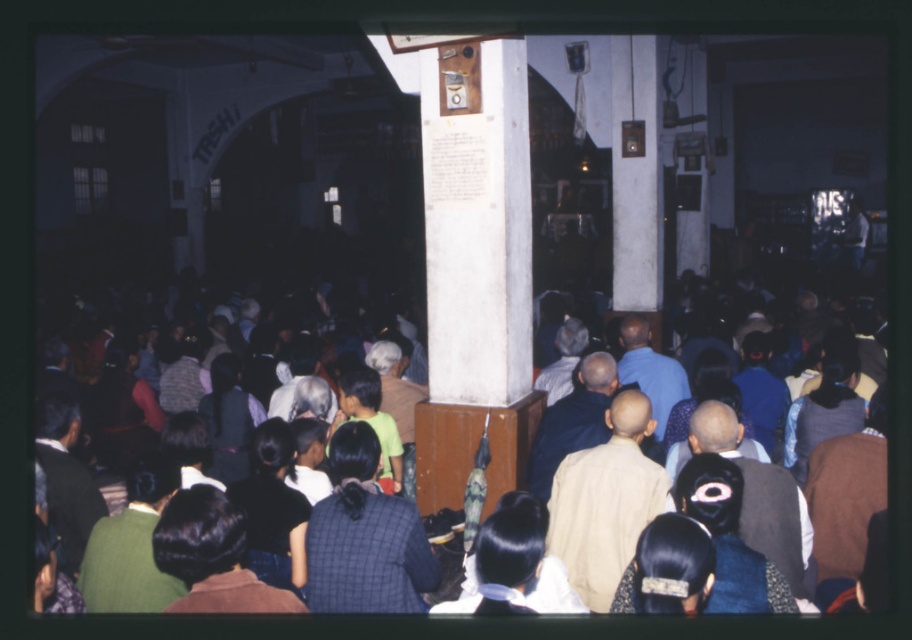
Question: Among these points, which one is farthest from the camera?

Choices:
 (A) (63, 493)
 (B) (776, 490)
 (C) (651, 392)

Answer: (C)

Question: Which of these objects is positioned farthest from the dark brown fabric crowd at center?

Choices:
 (A) light brown fabric jacket at center
 (B) dark brown vest at center
 (C) light beige fabric shirt at center

Answer: (B)

Question: Can you confirm if light brown fabric jacket at center is positioned below light brown hair at center?

Choices:
 (A) yes
 (B) no

Answer: (A)

Question: Which object appears farthest from the camera in this image?

Choices:
 (A) light brown fabric jacket at center
 (B) dark brown vest at center

Answer: (A)

Question: Considering the relative positions of dark brown fabric crowd at center and light brown hair at center in the image provided, where is dark brown fabric crowd at center located with respect to light brown hair at center?

Choices:
 (A) left
 (B) right

Answer: (A)

Question: Does dark brown fabric crowd at center have a larger size compared to light brown hair at center?

Choices:
 (A) yes
 (B) no

Answer: (B)